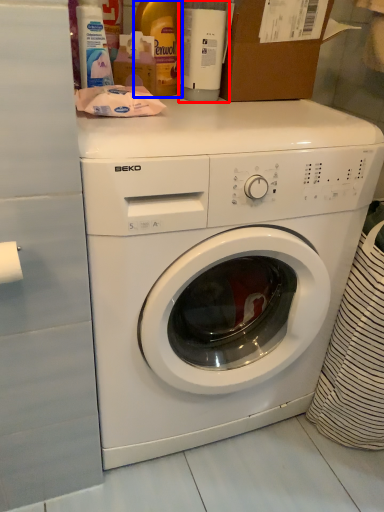
Question: Which object is further to the camera taking this photo, bottle (highlighted by a red box) or bottle (highlighted by a blue box)?

Choices:
 (A) bottle
 (B) bottle

Answer: (B)